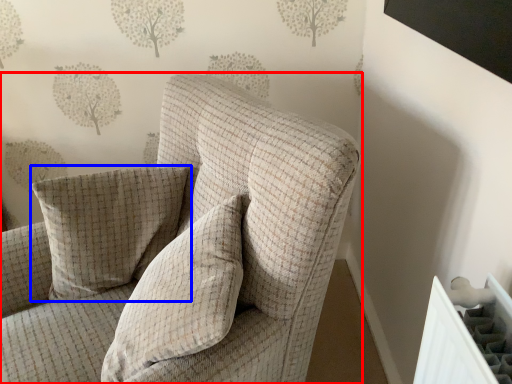
Question: Which object is further to the camera taking this photo, chair (highlighted by a red box) or pillow (highlighted by a blue box)?

Choices:
 (A) chair
 (B) pillow

Answer: (B)